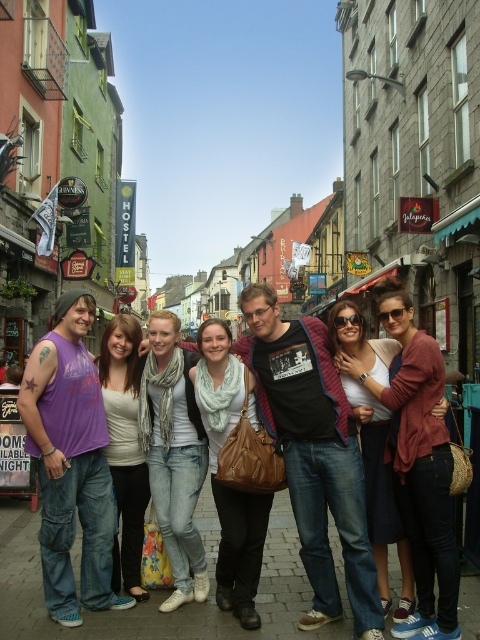
Question: Is light blue denim jeans at center below denim skirt at center?

Choices:
 (A) no
 (B) yes

Answer: (A)

Question: Where is light blue scarf at center located in relation to light beige scarf at center in the image?

Choices:
 (A) below
 (B) above

Answer: (A)

Question: Which point appears closest to the camera in this image?

Choices:
 (A) (364, 396)
 (B) (132, 412)
 (C) (199, 333)

Answer: (A)

Question: Which of the following is the closest to the observer?

Choices:
 (A) (364, 422)
 (B) (213, 467)
 (C) (192, 563)

Answer: (C)

Question: Which is farther from the light beige scarf at center?

Choices:
 (A) light blue scarf at center
 (B) denim skirt at center

Answer: (B)

Question: Is denim skirt at center above light beige scarf at center?

Choices:
 (A) no
 (B) yes

Answer: (B)